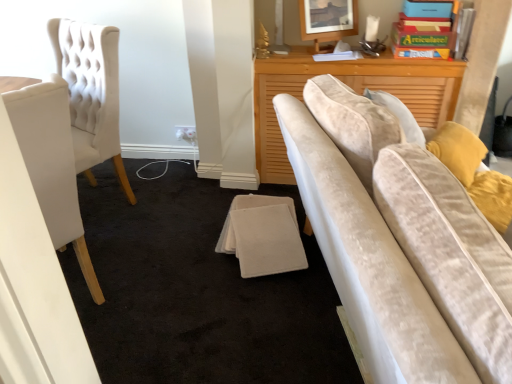
Question: Should I look upward or downward to see wooden picture frame at upper center?

Choices:
 (A) up
 (B) down

Answer: (A)

Question: From the image's perspective, is wooden picture frame at upper center below white fabric chair at left?

Choices:
 (A) no
 (B) yes

Answer: (A)

Question: Is wooden picture frame at upper center facing towards white fabric chair at left?

Choices:
 (A) no
 (B) yes

Answer: (A)

Question: Considering the relative sizes of wooden picture frame at upper center and white fabric chair at left in the image provided, is wooden picture frame at upper center thinner than white fabric chair at left?

Choices:
 (A) no
 (B) yes

Answer: (B)

Question: Can you confirm if wooden picture frame at upper center is smaller than white fabric chair at left?

Choices:
 (A) no
 (B) yes

Answer: (B)

Question: Is wooden picture frame at upper center oriented away from white fabric chair at left?

Choices:
 (A) no
 (B) yes

Answer: (A)

Question: Would you consider wooden picture frame at upper center to be distant from white fabric chair at left?

Choices:
 (A) yes
 (B) no

Answer: (A)

Question: Is white fabric chair at left at the left side of wooden picture frame at upper center?

Choices:
 (A) no
 (B) yes

Answer: (B)

Question: Is white fabric chair at left positioned before wooden picture frame at upper center?

Choices:
 (A) no
 (B) yes

Answer: (B)

Question: From a real-world perspective, is white fabric chair at left beneath wooden picture frame at upper center?

Choices:
 (A) yes
 (B) no

Answer: (A)

Question: Are white fabric chair at left and wooden picture frame at upper center far apart?

Choices:
 (A) yes
 (B) no

Answer: (A)

Question: Is white fabric chair at left positioned with its back to wooden picture frame at upper center?

Choices:
 (A) no
 (B) yes

Answer: (A)

Question: Is white fabric chair at left not inside wooden picture frame at upper center?

Choices:
 (A) no
 (B) yes

Answer: (B)

Question: From their relative heights in the image, would you say wooden picture frame at upper center is taller or shorter than white fabric chair at left?

Choices:
 (A) short
 (B) tall

Answer: (A)